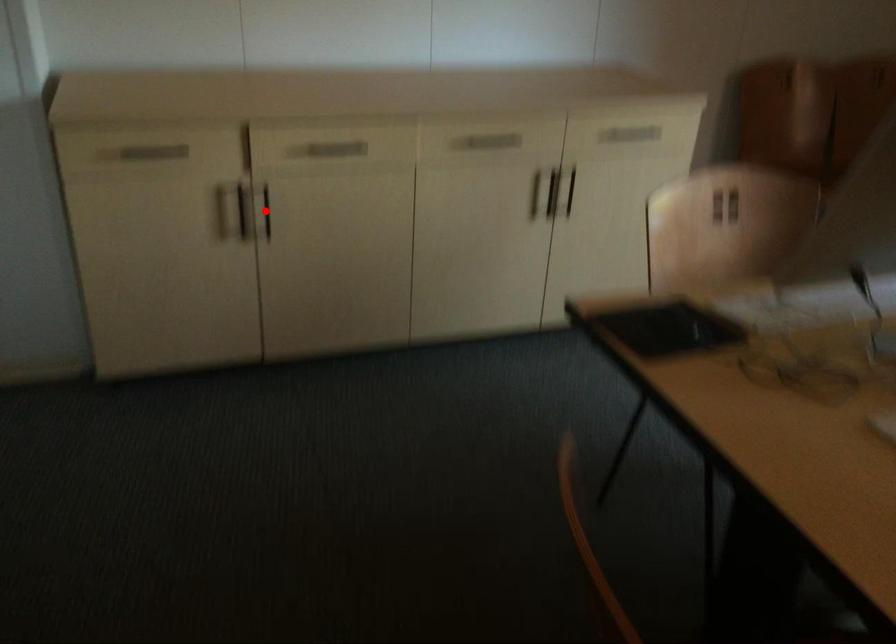
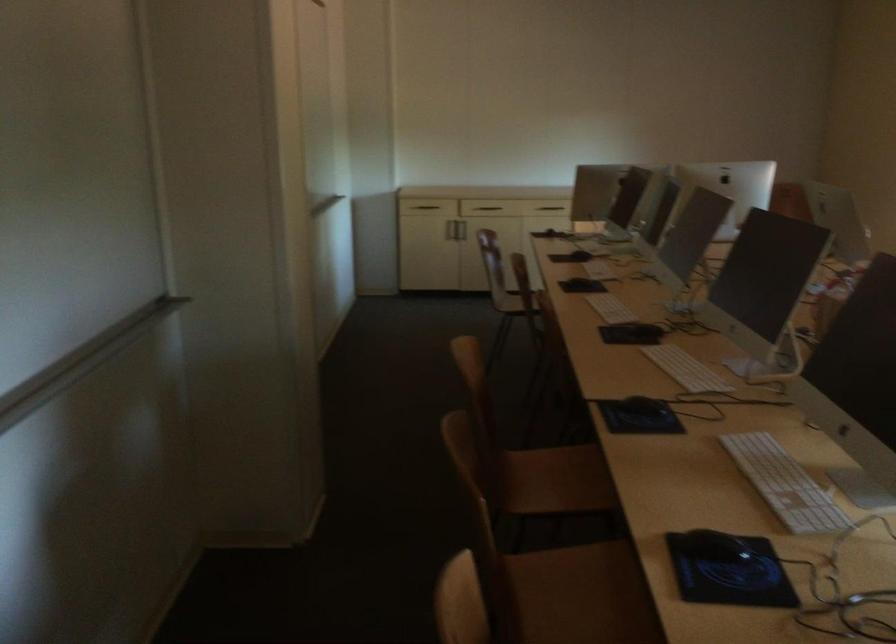
Where in the second image is the point corresponding to the highlighted location from the first image?

(463, 214)